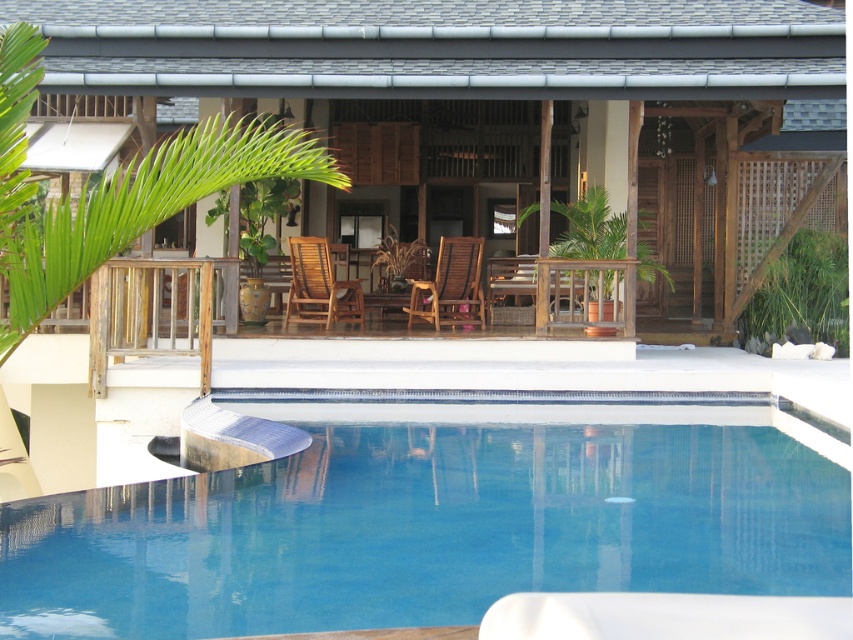
Question: Which point appears closest to the camera in this image?

Choices:
 (A) (334, 300)
 (B) (381, 60)
 (C) (355, 406)
 (D) (413, 288)

Answer: (C)

Question: Which object is the closest to the teak wood armchair at center?

Choices:
 (A) brown wooden armchair at center
 (B) wooden hut at center

Answer: (A)

Question: Which object is positioned closest to the teak wood armchair at center?

Choices:
 (A) clear glass pool at center
 (B) brown wooden armchair at center

Answer: (B)

Question: Is brown wooden armchair at center in front of teak wood armchair at center?

Choices:
 (A) no
 (B) yes

Answer: (A)

Question: Considering the relative positions of wooden hut at center and teak wood armchair at center in the image provided, where is wooden hut at center located with respect to teak wood armchair at center?

Choices:
 (A) above
 (B) below

Answer: (A)

Question: Is wooden hut at center below clear glass pool at center?

Choices:
 (A) no
 (B) yes

Answer: (A)